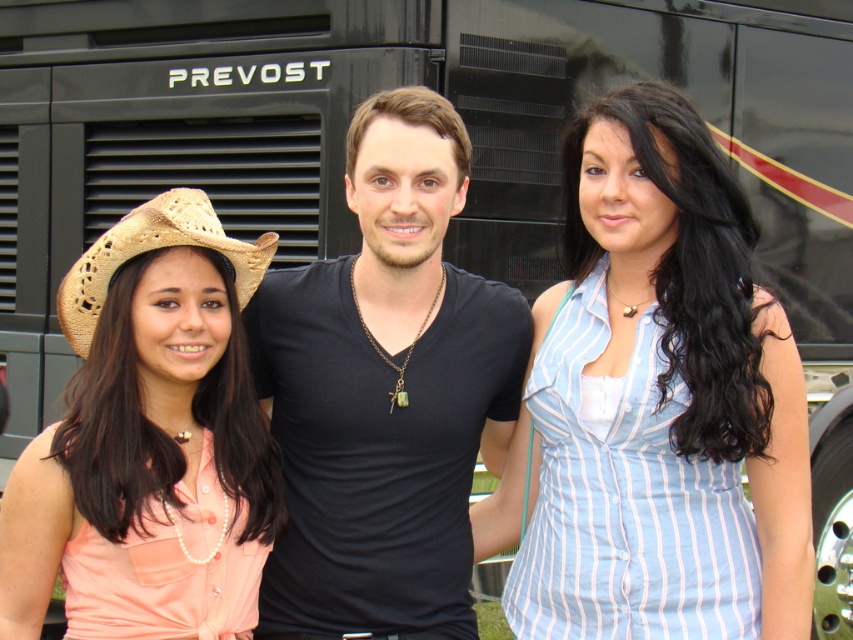
You are standing in front of the Prevost bus and see the point marked at coordinates (141, 397). What object is located at that point?

The point at coordinates (141, 397) marks the pink fabric shirt at left.